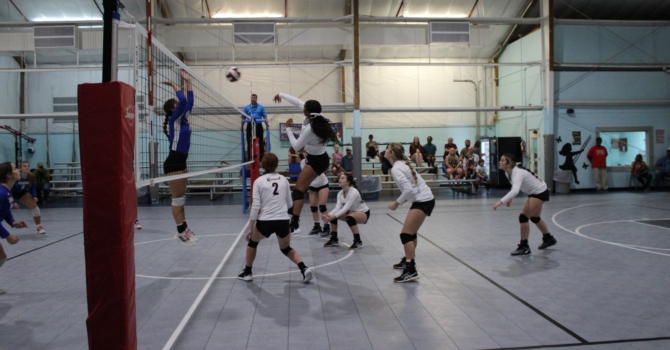
You are a GUI agent. You are given a task and a screenshot of the screen. Output one action in this format:
    pyautogui.click(x=<x>, y=<y>)
    Task: Click on the air conditioners
    This screenshot has width=670, height=350.
    Given the screenshot: What is the action you would take?
    pyautogui.click(x=447, y=31), pyautogui.click(x=252, y=35), pyautogui.click(x=53, y=37)